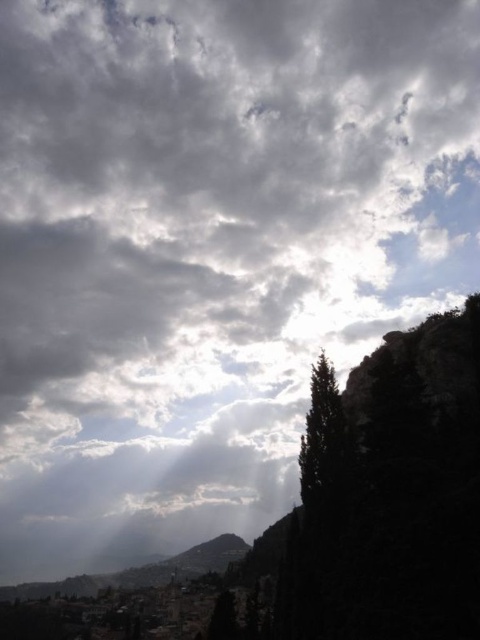
Which is above, green matte tree at center-right or rugged stone mountain at lower center?

green matte tree at center-right is higher up.

Between point (335, 488) and point (95, 586), which one is positioned behind?

Point (95, 586)

Where is `green matte tree at center-right`? This screenshot has width=480, height=640. green matte tree at center-right is located at coordinates (324, 444).